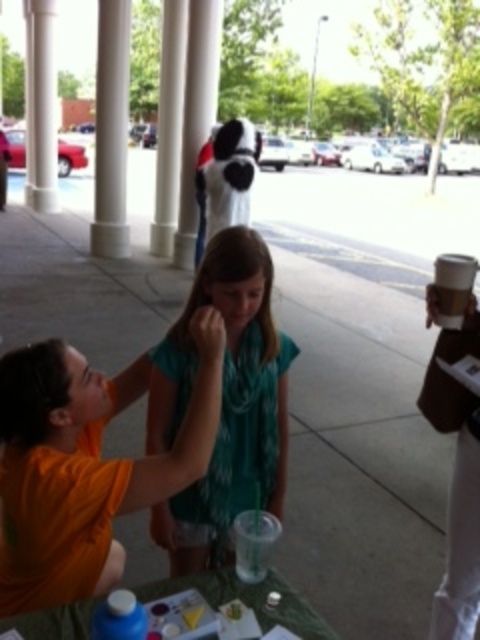
Question: In this image, where is white smooth column at left located relative to white smooth pillar at upper center?

Choices:
 (A) left
 (B) right

Answer: (A)

Question: Among these objects, which one is farthest from the camera?

Choices:
 (A) orange cotton shirt at upper left
 (B) white smooth pillar at upper center
 (C) white smooth column at upper left
 (D) teal fabric scarf at center

Answer: (C)

Question: Which of the following is the closest to the observer?

Choices:
 (A) (214, 486)
 (B) (127, 236)
 (C) (207, 22)
 (D) (41, 28)

Answer: (A)

Question: Which object is positioned closest to the white smooth pillar at upper center?

Choices:
 (A) teal fabric scarf at center
 (B) orange cotton shirt at upper left
 (C) white smooth column at left
 (D) translucent plastic table at lower center

Answer: (C)

Question: Where is white smooth column at left located in relation to translucent plastic table at lower center in the image?

Choices:
 (A) above
 (B) below

Answer: (A)

Question: Where is white smooth column at left located in relation to white smooth pillar at upper center in the image?

Choices:
 (A) right
 (B) left

Answer: (B)